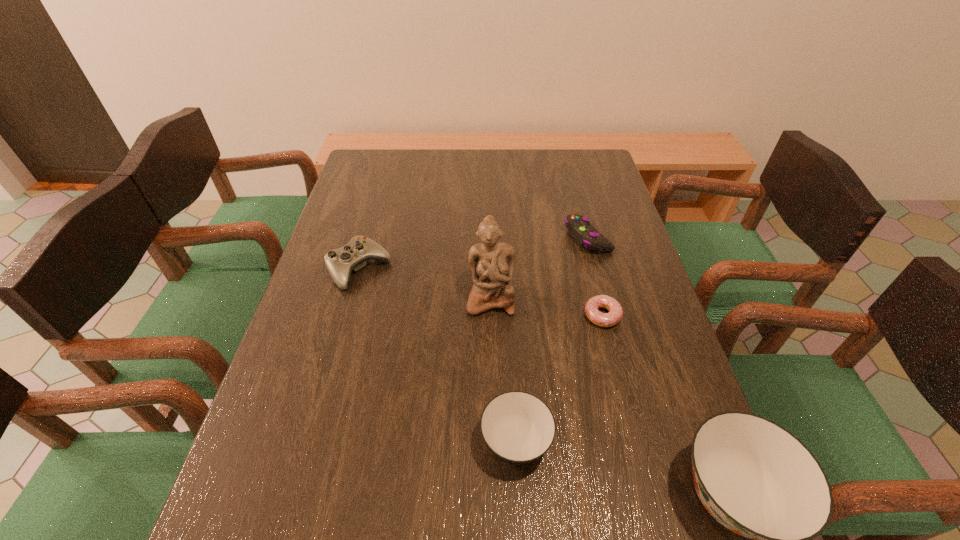
This screenshot has height=540, width=960. Identify the location of vacant space that satisfies the following two spatial constraints: 1. on the front-facing side of the shortest object; 2. on the left side of the figurine. (491, 316).